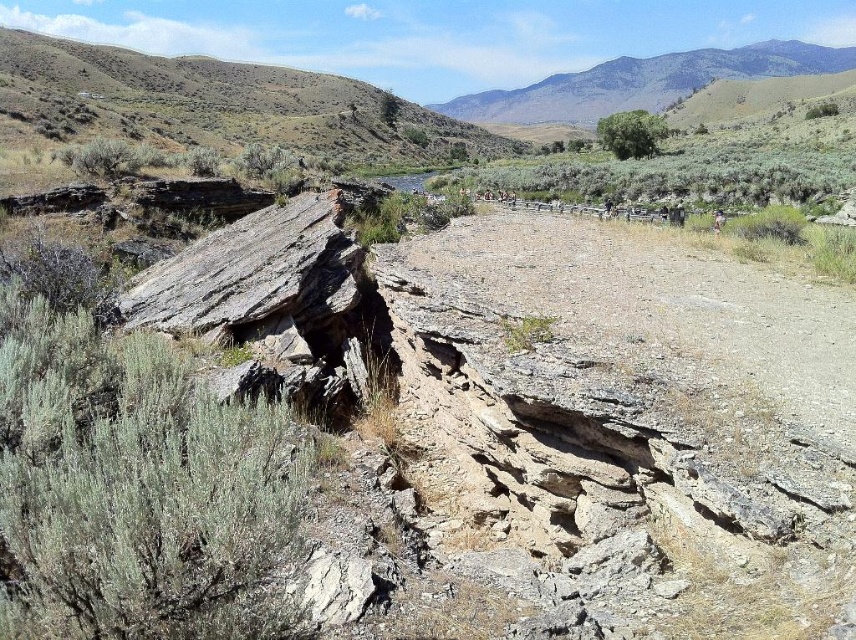
Question: Which point is closer to the camera?

Choices:
 (A) coord(601,122)
 (B) coord(694,60)

Answer: (A)

Question: Where is gray rocky mountain at upper center located in relation to green leafy tree at upper center in the image?

Choices:
 (A) right
 (B) left

Answer: (A)

Question: Observing the image, what is the correct spatial positioning of gray rocky mountain at upper center in reference to green leafy tree at upper center?

Choices:
 (A) left
 (B) right

Answer: (B)

Question: Observing the image, what is the correct spatial positioning of gray rocky mountain at upper center in reference to green leafy tree at upper center?

Choices:
 (A) right
 (B) left

Answer: (A)

Question: Among these points, which one is farthest from the camera?

Choices:
 (A) (479, 93)
 (B) (608, 145)

Answer: (A)